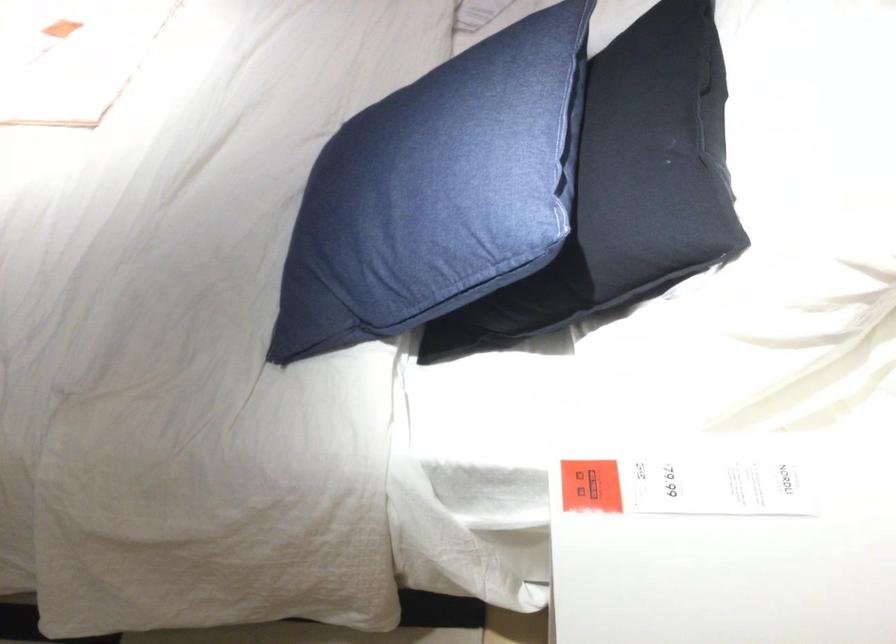
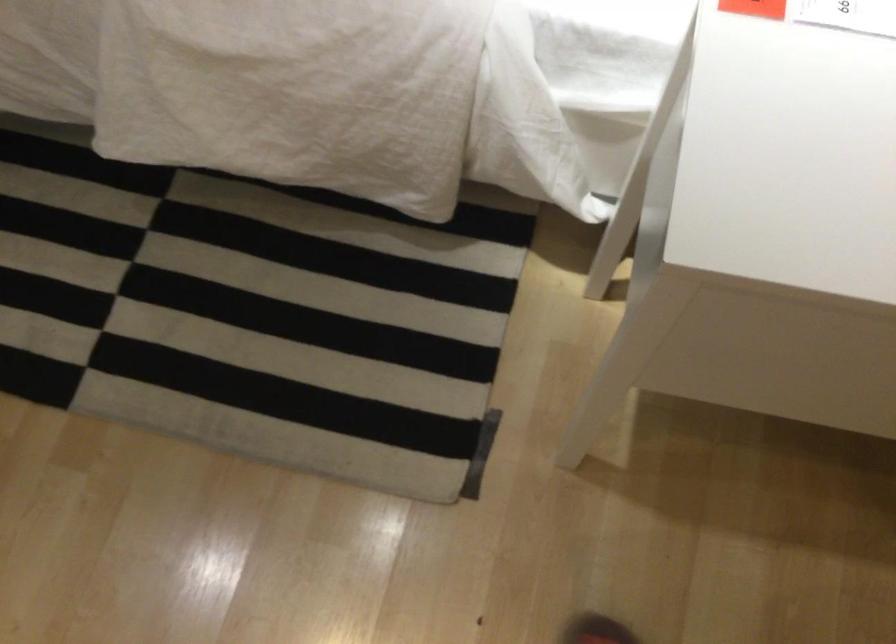
Question: The images are taken continuously from a first-person perspective. In which direction is your viewpoint rotating?

Choices:
 (A) Left
 (B) Right
 (C) Up
 (D) Down

Answer: (D)